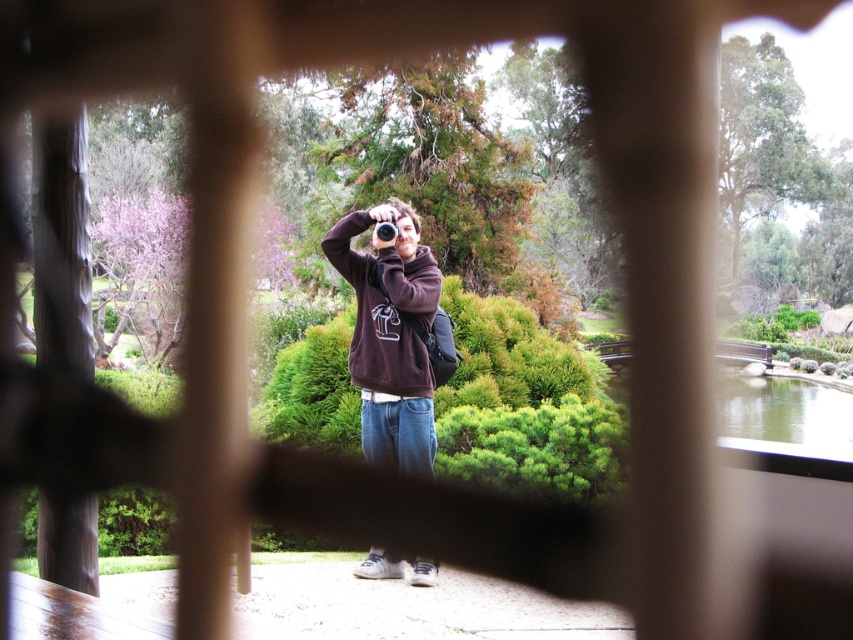
Is point (430, 269) less distant than point (390, 240)?

No, (430, 269) is behind (390, 240).

Who is taller, brown fleece sweatshirt at center or black plastic camera at center?

brown fleece sweatshirt at center

Between point (428, 317) and point (386, 237), which one is positioned behind?

Point (386, 237)

Where is `brown fleece sweatshirt at center`? The height and width of the screenshot is (640, 853). brown fleece sweatshirt at center is located at coordinates (386, 307).

Who is more distant from viewer, (421,365) or (376,227)?

The point (376,227) is more distant.

Where is `brown fleece at center`? The image size is (853, 640). brown fleece at center is located at coordinates (390, 336).

Is brown fleece at center closer to the viewer compared to brown fleece sweatshirt at center?

Yes.

Who is more distant from viewer, (384, 282) or (350, 371)?

The point (350, 371) is behind.

The image size is (853, 640). What do you see at coordinates (390, 336) in the screenshot?
I see `brown fleece at center` at bounding box center [390, 336].

Find the location of `brown fleece at center`. brown fleece at center is located at coordinates (390, 336).